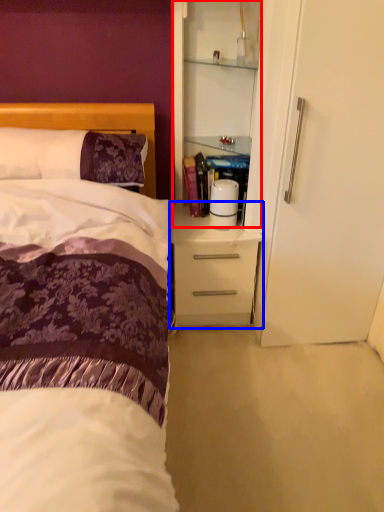
Question: Among these objects, which one is nearest to the camera, cabinetry (highlighted by a red box) or desk (highlighted by a blue box)?

Choices:
 (A) cabinetry
 (B) desk

Answer: (A)